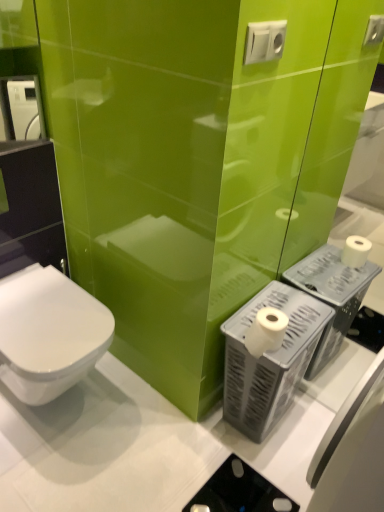
Question: Is white plastic toilet paper holder at lower right touching white glossy toilet at lower left?

Choices:
 (A) no
 (B) yes

Answer: (A)

Question: Can you confirm if white plastic toilet paper holder at lower right is taller than white glossy toilet at lower left?

Choices:
 (A) no
 (B) yes

Answer: (B)

Question: Is white plastic toilet paper holder at lower right facing away from white glossy toilet at lower left?

Choices:
 (A) yes
 (B) no

Answer: (B)

Question: Is white plastic toilet paper holder at lower right shorter than white glossy toilet at lower left?

Choices:
 (A) yes
 (B) no

Answer: (B)

Question: From a real-world perspective, does white plastic toilet paper holder at lower right stand above white glossy toilet at lower left?

Choices:
 (A) yes
 (B) no

Answer: (B)

Question: Does white plastic toilet paper holder at lower right have a larger size compared to white glossy toilet at lower left?

Choices:
 (A) yes
 (B) no

Answer: (B)

Question: Is white plastic electric outlet at upper center smaller than white matte toilet paper at right?

Choices:
 (A) no
 (B) yes

Answer: (B)

Question: Is white plastic electric outlet at upper center completely or partially outside of white matte toilet paper at right?

Choices:
 (A) no
 (B) yes

Answer: (B)

Question: Does white plastic electric outlet at upper center turn towards white matte toilet paper at right?

Choices:
 (A) yes
 (B) no

Answer: (B)

Question: Is white plastic electric outlet at upper center taller than white matte toilet paper at right?

Choices:
 (A) no
 (B) yes

Answer: (A)

Question: Is white plastic electric outlet at upper center positioned before white matte toilet paper at right?

Choices:
 (A) no
 (B) yes

Answer: (B)

Question: Is white matte toilet paper at right at the back of white plastic electric outlet at upper center?

Choices:
 (A) no
 (B) yes

Answer: (A)

Question: Is white plastic electric outlet at upper center next to white plastic toilet paper holder at lower right?

Choices:
 (A) no
 (B) yes

Answer: (A)